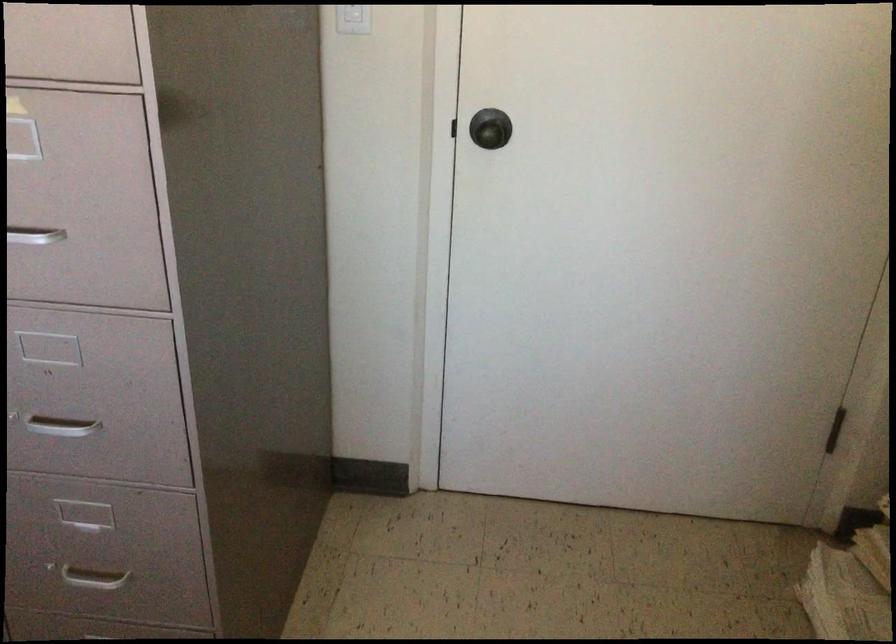
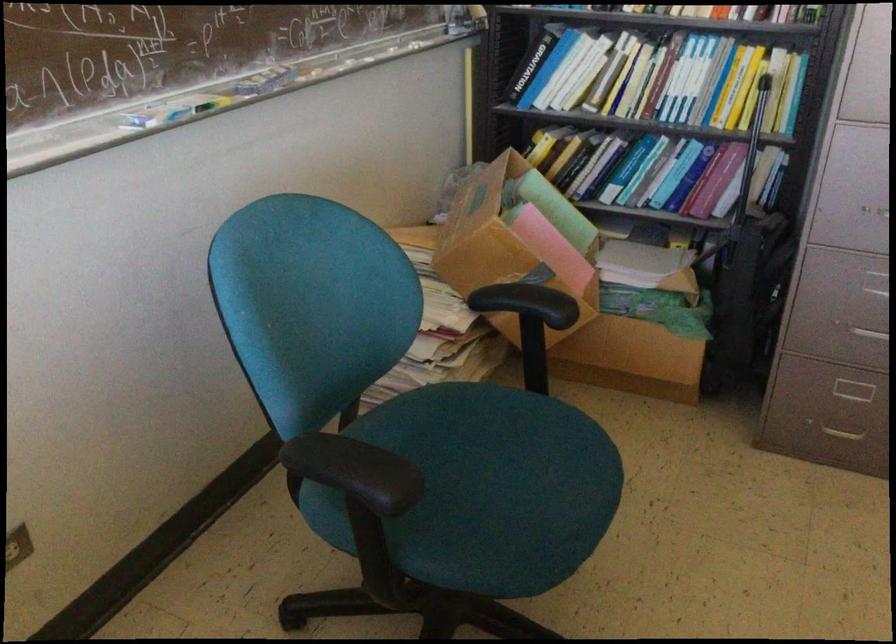
Find the pixel in the second image that matches the point at 128,574 in the first image.

(869, 330)